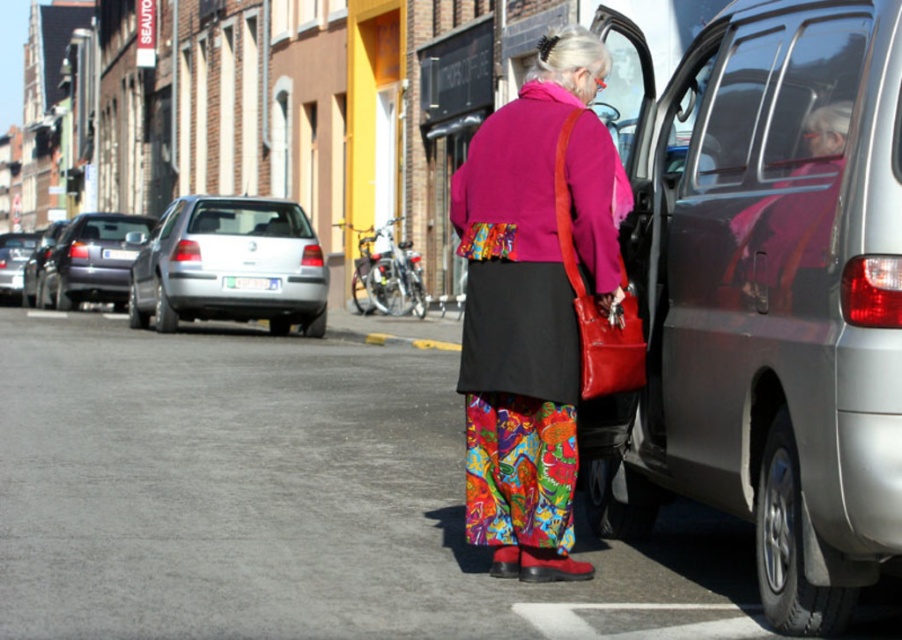
What do you see at coordinates (764, 296) in the screenshot? I see `metallic gray suv at right` at bounding box center [764, 296].

Is metallic gray suv at right below silver metallic car at left?

Indeed, metallic gray suv at right is positioned under silver metallic car at left.

Between point (700, 196) and point (154, 314), which one is positioned behind?

Positioned behind is point (154, 314).

The width and height of the screenshot is (902, 640). I want to click on metallic gray suv at right, so click(x=764, y=296).

Does metallic gray suv at right have a greater width compared to metallic silver sedan at left?

No, metallic gray suv at right is not wider than metallic silver sedan at left.

Is metallic gray suv at right further to the viewer compared to metallic silver sedan at left?

No, metallic gray suv at right is closer to the viewer.

Is point (753, 282) less distant than point (26, 284)?

Yes, it is in front of point (26, 284).

This screenshot has width=902, height=640. I want to click on metallic gray suv at right, so click(764, 296).

What do you see at coordinates (229, 266) in the screenshot? This screenshot has width=902, height=640. I see `silver metallic car at left` at bounding box center [229, 266].

Can you confirm if silver metallic car at left is positioned to the right of metallic silver sedan at left?

Indeed, silver metallic car at left is positioned on the right side of metallic silver sedan at left.

Between point (302, 259) and point (76, 234), which one is positioned behind?

Positioned behind is point (76, 234).

Find the location of a particular element. silver metallic car at left is located at coordinates 229,266.